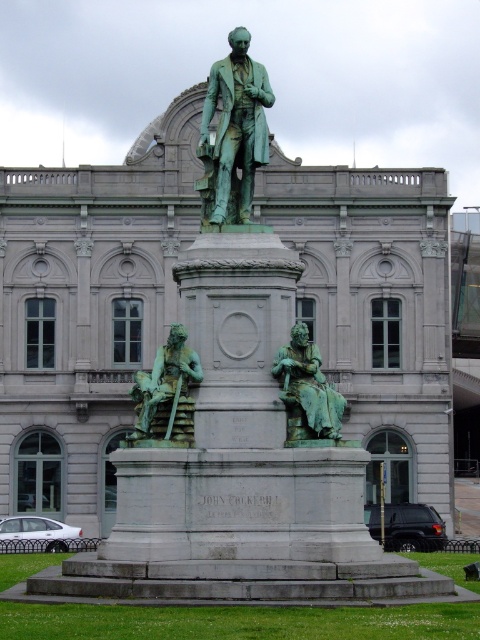
Does point (242, 136) come behind point (169, 387)?

Yes, point (242, 136) is farther from viewer.

Who is positioned more to the left, green patina bronze statue at center or green patinated bronze statue at lower left?

Positioned to the left is green patinated bronze statue at lower left.

The image size is (480, 640). What do you see at coordinates (233, 132) in the screenshot?
I see `green patina bronze statue at center` at bounding box center [233, 132].

Locate an element on the screen. The width and height of the screenshot is (480, 640). green patina bronze statue at center is located at coordinates (233, 132).

Does point (170, 410) come closer to viewer compared to point (328, 426)?

No, it is not.

Is point (139, 385) farther from camera compared to point (277, 356)?

That is True.

Find the location of a particular element. The width and height of the screenshot is (480, 640). green patinated bronze statue at lower left is located at coordinates (166, 396).

Can you confirm if green patina bronze statue at center is positioned to the left of green patina statue at center?

Correct, you'll find green patina bronze statue at center to the left of green patina statue at center.

Is point (239, 42) farther from camera compared to point (288, 428)?

That is True.

This screenshot has height=640, width=480. I want to click on green patina bronze statue at center, so click(x=233, y=132).

Find the location of `green patina bronze statue at center`. green patina bronze statue at center is located at coordinates (233, 132).